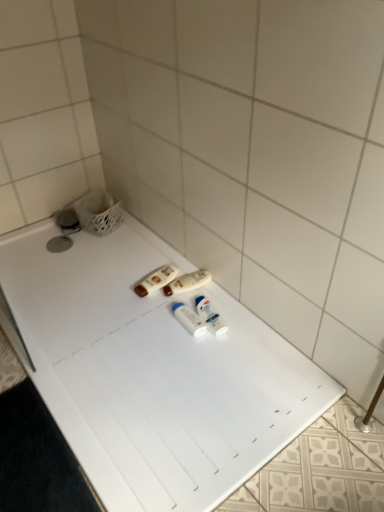
You are a GUI agent. You are given a task and a screenshot of the screen. Output one action in this format:
    pyautogui.click(x=<x>, y=<y>)
    Task: Click on the free spot to the right of white plastic deodorant at center, acting as the first toiletry starting from the right
    The width and height of the screenshot is (384, 512).
    Given the screenshot: What is the action you would take?
    [240, 325]